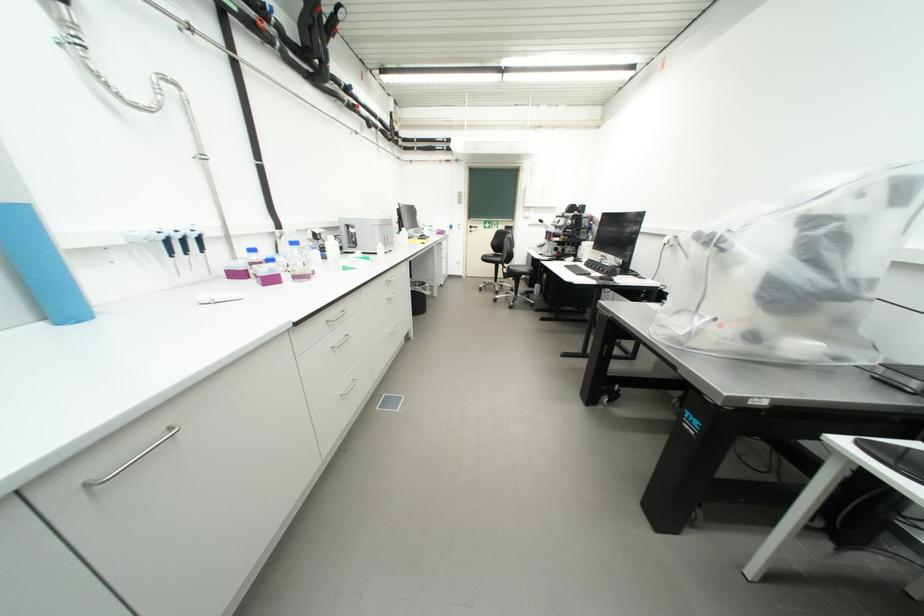
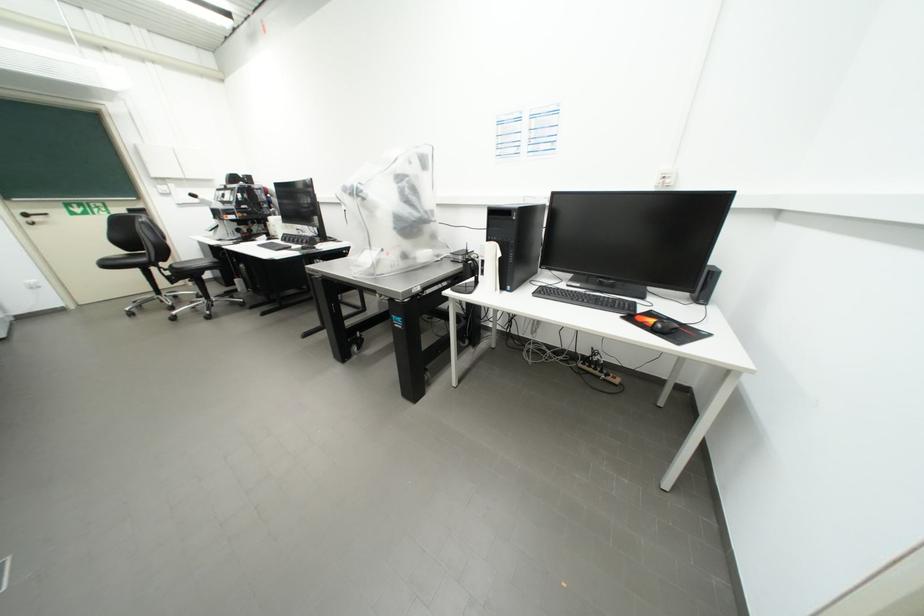
In the second image, find the point that corresponds to (480,231) in the first image.

(43, 220)